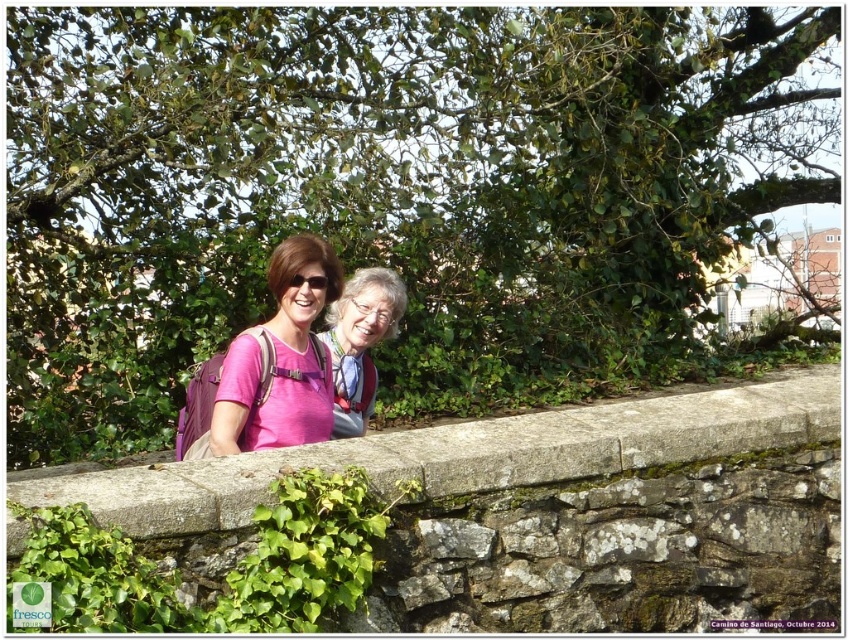
The image size is (848, 640). Describe the element at coordinates (383, 189) in the screenshot. I see `green leafy tree at upper center` at that location.

Does green leafy tree at upper center have a smaller size compared to pink fabric at center?

No.

Is point (785, 64) less distant than point (338, 426)?

That is False.

I want to click on green leafy tree at upper center, so click(383, 189).

Where is `gray stone ledge at center`? The width and height of the screenshot is (848, 640). gray stone ledge at center is located at coordinates [x=467, y=452].

Describe the element at coordinates (467, 452) in the screenshot. The height and width of the screenshot is (640, 848). I see `gray stone ledge at center` at that location.

The image size is (848, 640). I want to click on gray stone ledge at center, so click(467, 452).

Can you confirm if gray stone ledge at center is positioned above pink fabric shirt at center?

No, gray stone ledge at center is not above pink fabric shirt at center.

Does gray stone ledge at center have a lesser height compared to pink fabric shirt at center?

Indeed, gray stone ledge at center has a lesser height compared to pink fabric shirt at center.

Is point (246, 506) less distant than point (236, 396)?

That is True.

Where is `gray stone ledge at center`? gray stone ledge at center is located at coordinates (467, 452).